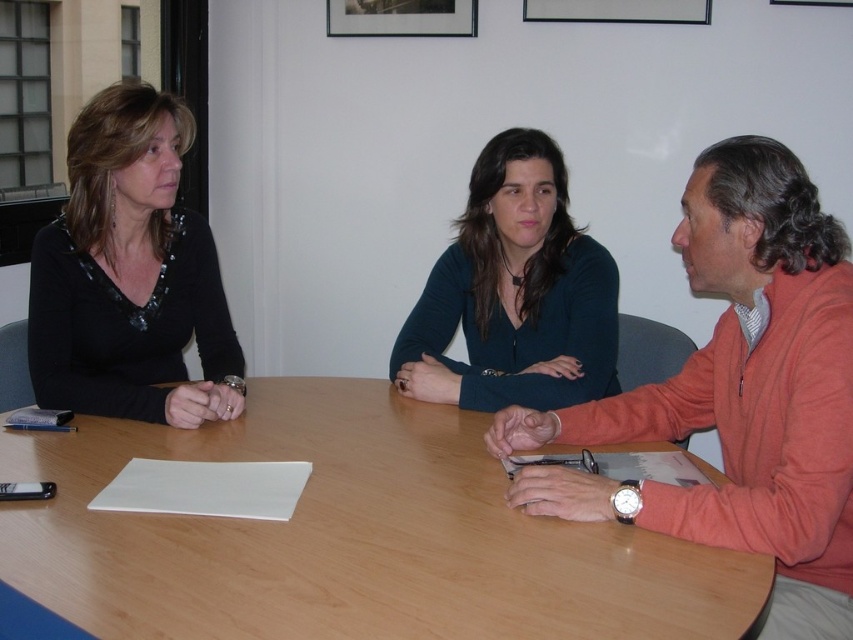
Does black matte shirt at left appear on the left side of teal matte sweater at center?

Correct, you'll find black matte shirt at left to the left of teal matte sweater at center.

Can you confirm if black matte shirt at left is positioned below teal matte sweater at center?

Actually, black matte shirt at left is above teal matte sweater at center.

Is point (122, 173) positioned after point (590, 342)?

Yes, it is.

What are the coordinates of `black matte shirt at left` in the screenshot? It's located at (131, 275).

Is orange fleece jacket at right below teal matte sweater at center?

Yes.

Between orange fleece jacket at right and teal matte sweater at center, which one appears on the left side from the viewer's perspective?

From the viewer's perspective, teal matte sweater at center appears more on the left side.

Is point (660, 508) in front of point (480, 371)?

That is True.

Image resolution: width=853 pixels, height=640 pixels. Identify the location of orange fleece jacket at right. (738, 394).

Does light brown wood table at center appear under black matte shirt at left?

Result: Correct, light brown wood table at center is located below black matte shirt at left.

Is point (273, 586) in front of point (193, 305)?

That is True.

Locate an element on the screen. light brown wood table at center is located at coordinates (349, 538).